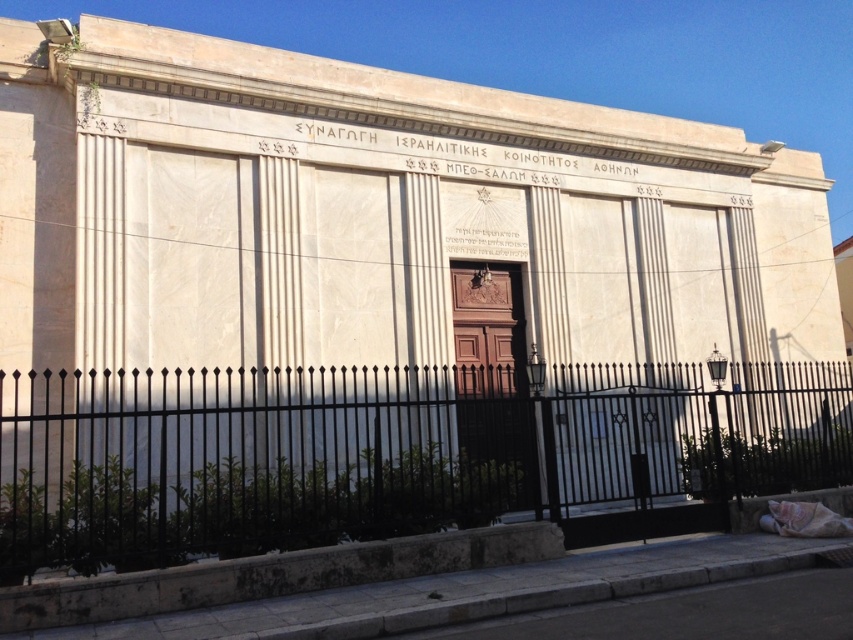
Question: From the image, what is the correct spatial relationship of black wrought iron fence at lower center in relation to gray concrete curb at lower center?

Choices:
 (A) left
 (B) right

Answer: (B)

Question: Can you confirm if black wrought iron fence at lower center is positioned to the right of gray concrete curb at lower center?

Choices:
 (A) no
 (B) yes

Answer: (B)

Question: Among these points, which one is farthest from the camera?

Choices:
 (A) (326, 580)
 (B) (109, 420)

Answer: (B)

Question: In this image, where is black wrought iron fence at lower center located relative to gray concrete curb at lower center?

Choices:
 (A) left
 (B) right

Answer: (B)